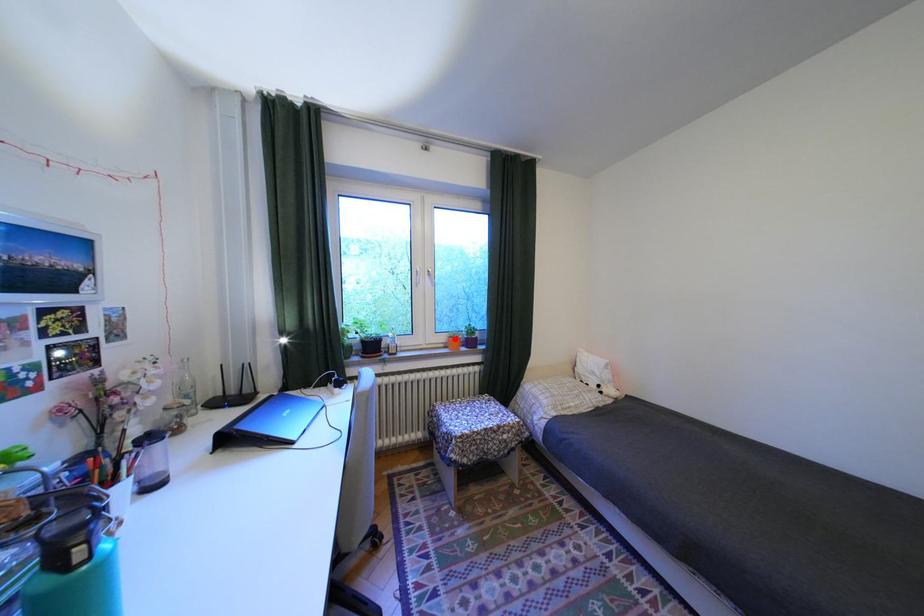
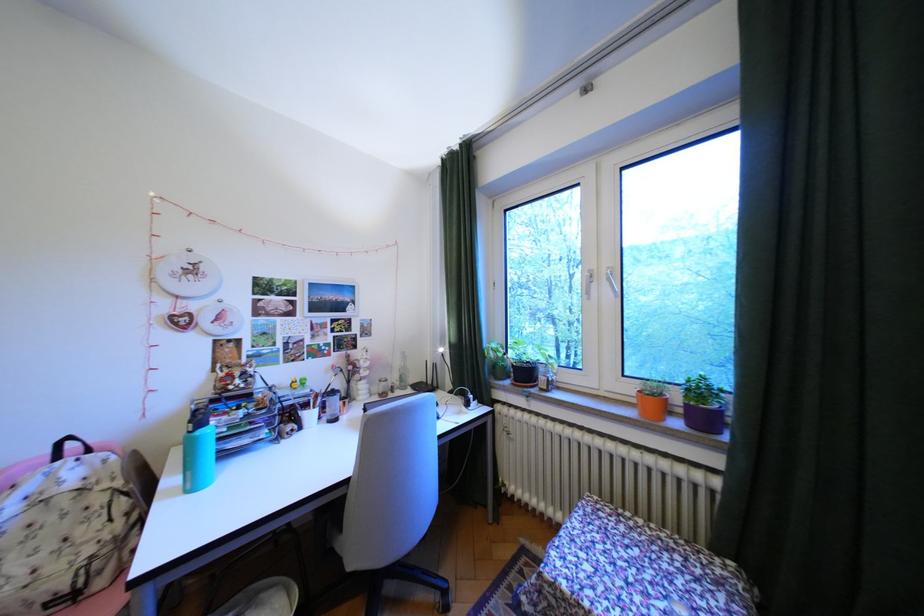
Locate, in the second image, the point that corresponds to the highlighted location in the first image.

(641, 390)